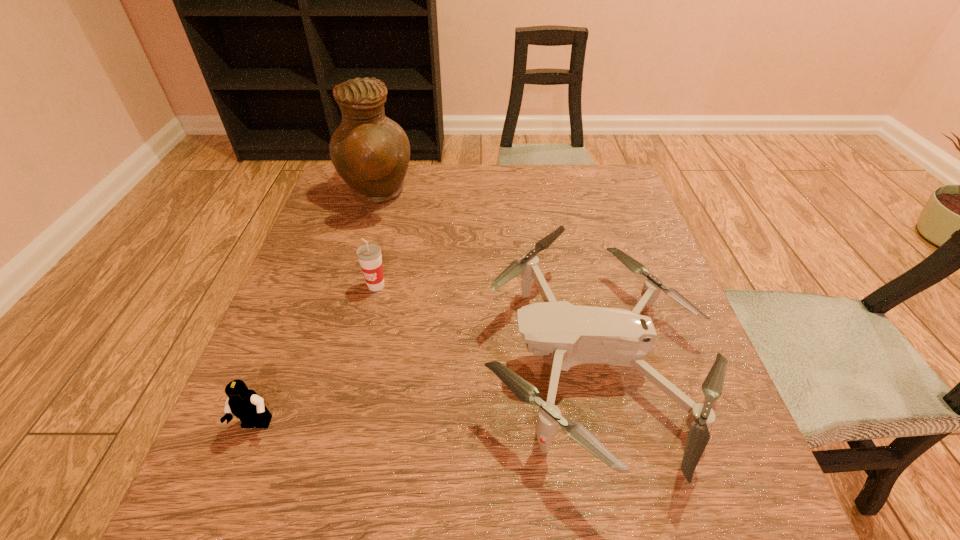
Find the location of a particular element. Image resolution: width=960 pixels, height=540 pixels. vacant space at the near edge of the desktop is located at coordinates (444, 525).

In the image, there is a desktop. Identify the location of free space at the left edge. (325, 226).

Where is `vacant space at the right edge of the desktop`? The width and height of the screenshot is (960, 540). vacant space at the right edge of the desktop is located at coordinates (598, 257).

Image resolution: width=960 pixels, height=540 pixels. I want to click on vacant space at the near left corner of the desktop, so click(241, 532).

Locate an element on the screen. empty location between the Lego and the drone is located at coordinates (425, 392).

Identify the location of free space between the cup and the tallest object. The image size is (960, 540). (376, 240).

The width and height of the screenshot is (960, 540). Find the location of `vacant space that's between the drone and the pitcher`. vacant space that's between the drone and the pitcher is located at coordinates (485, 276).

The height and width of the screenshot is (540, 960). Find the location of `free spot between the rightmost object and the cup`. free spot between the rightmost object and the cup is located at coordinates (485, 322).

Where is `blank region between the farthest object and the cup`? blank region between the farthest object and the cup is located at coordinates (376, 240).

The height and width of the screenshot is (540, 960). Find the location of `vacant area that lies between the cup and the rightmost object`. vacant area that lies between the cup and the rightmost object is located at coordinates (485, 322).